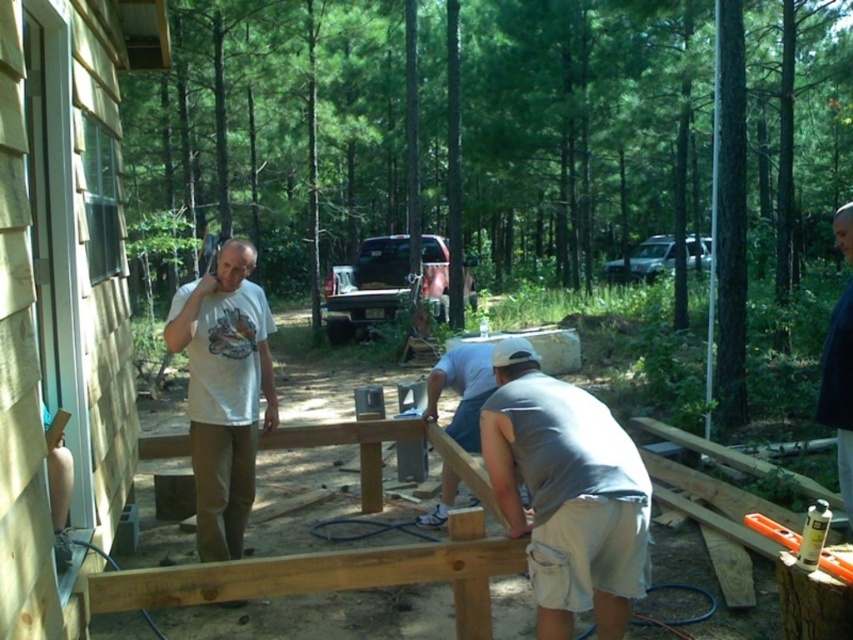
Is white cotton t-shirt at center smaller than gray fabric shirt at center?

Actually, white cotton t-shirt at center might be larger than gray fabric shirt at center.

Who is more forward, (222, 349) or (433, 397)?

Point (222, 349)

Locate an element on the screen. The height and width of the screenshot is (640, 853). white cotton t-shirt at center is located at coordinates (224, 392).

Does gray cotton shirt at center appear on the right side of white cotton t-shirt at center?

Correct, you'll find gray cotton shirt at center to the right of white cotton t-shirt at center.

Which is below, gray cotton shirt at center or white cotton t-shirt at center?

Positioned lower is gray cotton shirt at center.

Between point (647, 572) and point (259, 320), which one is positioned in front?

Point (647, 572) is more forward.

Locate an element on the screen. gray cotton shirt at center is located at coordinates (567, 493).

Is gray cotton shirt at center further to the viewer compared to dark blue shirt at upper right?

No, it is in front of dark blue shirt at upper right.

Is gray cotton shirt at center taller than dark blue shirt at upper right?

No, gray cotton shirt at center is not taller than dark blue shirt at upper right.

Locate an element on the screen. This screenshot has width=853, height=640. gray cotton shirt at center is located at coordinates (567, 493).